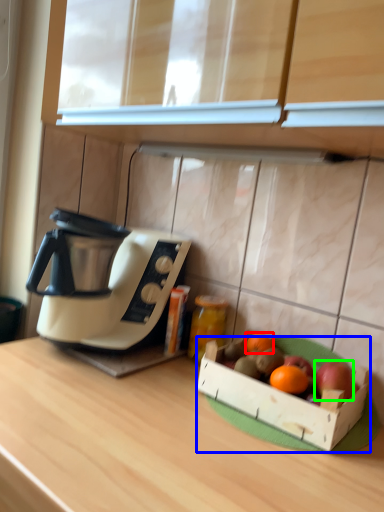
Question: Which object is the closest to the grapefruit (highlighted by a red box)? Choose among these: cardboard box (highlighted by a blue box) or apple (highlighted by a green box).

Choices:
 (A) cardboard box
 (B) apple

Answer: (A)